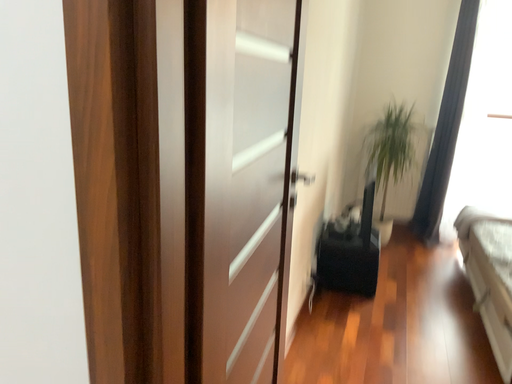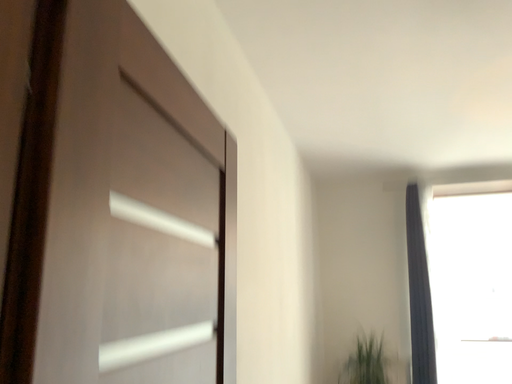
Question: How did the camera likely rotate when shooting the video?

Choices:
 (A) rotated upward
 (B) rotated downward

Answer: (A)